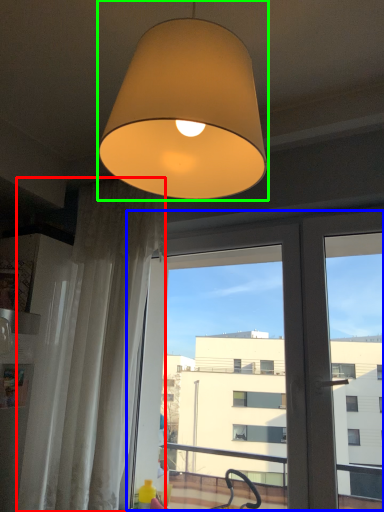
Question: Which object is the closest to the curtain (highlighted by a red box)? Choose among these: screen door (highlighted by a blue box) or lamp (highlighted by a green box).

Choices:
 (A) screen door
 (B) lamp

Answer: (A)